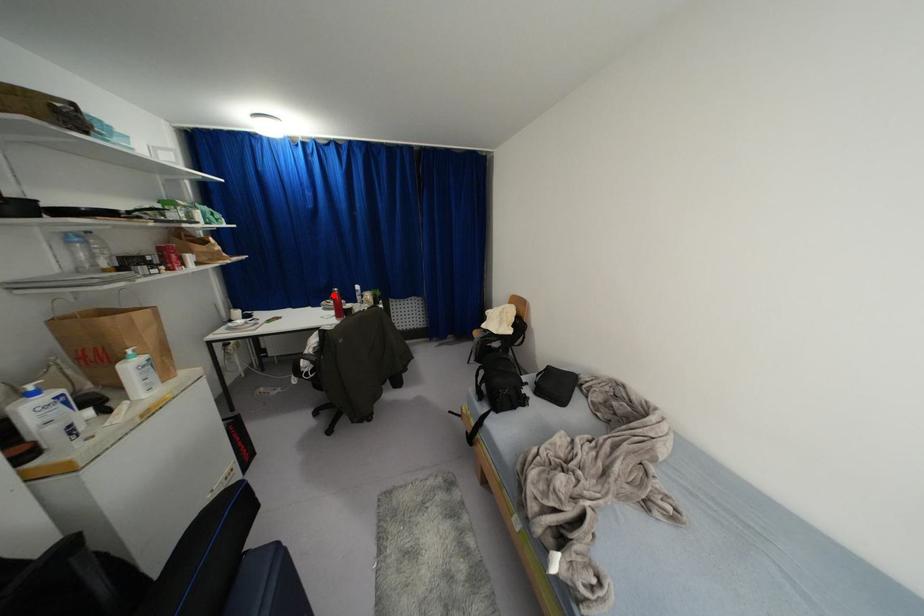
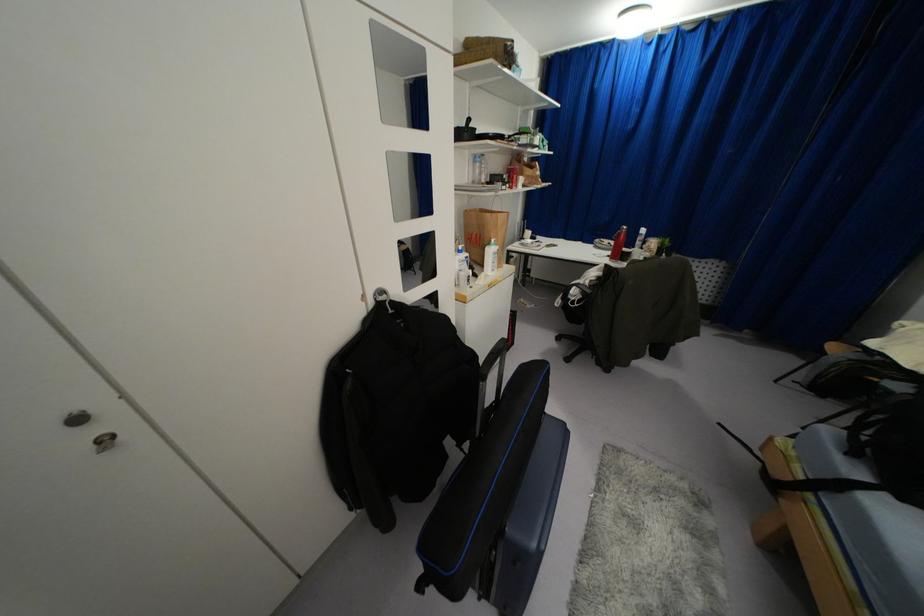
Question: I am providing you with two images of the same scene from different viewpoints. A red point is marked on the first image. Is the red point's position out of view in image 2?

Choices:
 (A) Yes
 (B) No

Answer: (B)